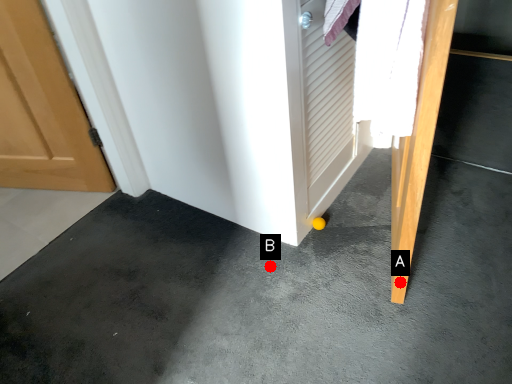
Question: Two points are circled on the image, labeled by A and B beside each circle. Which point is further to the camera?

Choices:
 (A) A is further
 (B) B is further

Answer: (B)